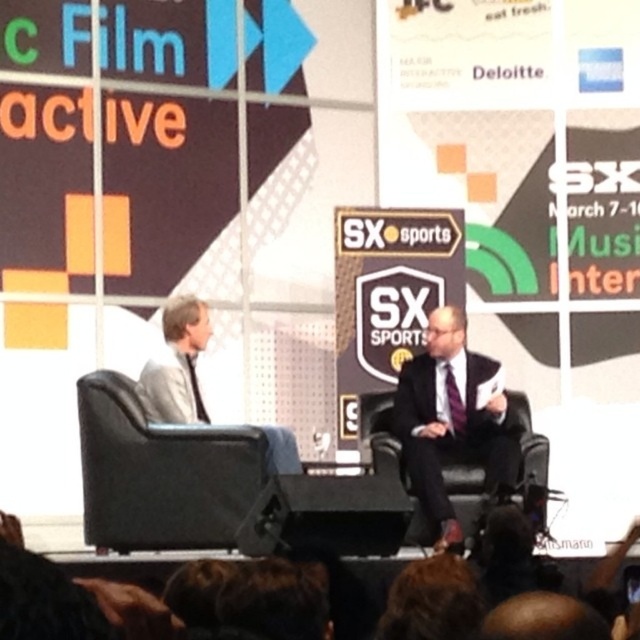
Question: Which of the following is the closest to the observer?

Choices:
 (A) light gray suit at left
 (B) dark suit at center

Answer: (A)

Question: Does dark suit at center have a smaller size compared to brown hair at lower center?

Choices:
 (A) yes
 (B) no

Answer: (A)

Question: Is black leather chair at left smaller than dark suit at center?

Choices:
 (A) yes
 (B) no

Answer: (B)

Question: In this image, where is black leather chair at left located relative to black fabric camera at lower center?

Choices:
 (A) above
 (B) below

Answer: (A)

Question: Estimate the real-world distances between objects in this image. Which object is closer to the black fabric camera at lower center?

Choices:
 (A) black leather chair at left
 (B) purple satin tie at center
 (C) light gray suit at left
 (D) dark suit at center

Answer: (B)

Question: Which point is farther from the camera taking this photo?

Choices:
 (A) (513, 506)
 (B) (465, 573)

Answer: (A)